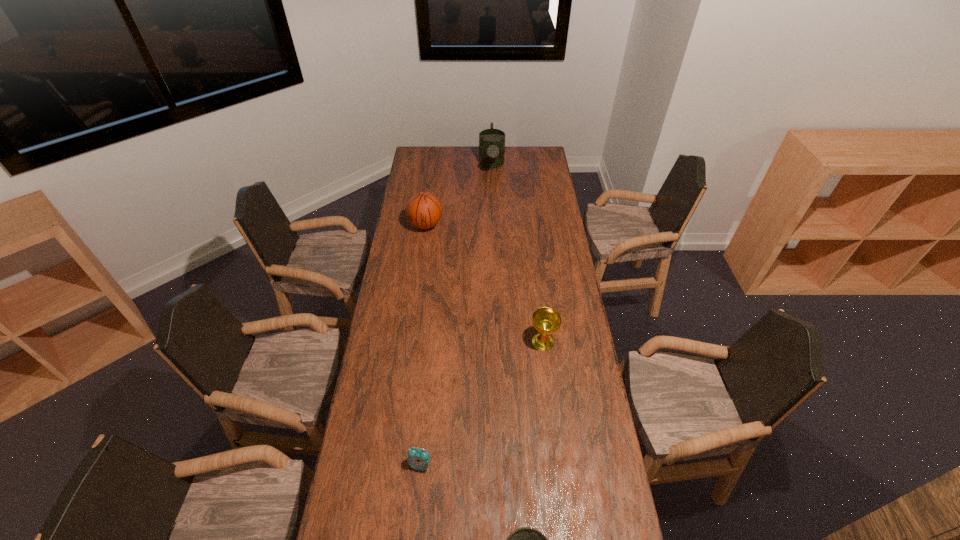
This screenshot has height=540, width=960. Find the location of `empty location between the second tallest object and the watering can`. empty location between the second tallest object and the watering can is located at coordinates (459, 195).

Find the location of `vacant space in between the basketball and the watering can`. vacant space in between the basketball and the watering can is located at coordinates (459, 195).

The width and height of the screenshot is (960, 540). Identify the location of free area in between the alarm clock and the chalice. (482, 403).

Find the location of `vacant area between the chalice and the fourth farthest object`. vacant area between the chalice and the fourth farthest object is located at coordinates (482, 403).

Locate which object is the fourth closest to the farthest object. Please provide its 2D coordinates. Your answer should be formatted as a tuple, i.e. [(x, y)], where the tuple contains the x and y coordinates of a point satisfying the conditions above.

[(525, 539)]

The image size is (960, 540). Find the location of `object that is the second closest one to the second farthest object`. object that is the second closest one to the second farthest object is located at coordinates (546, 321).